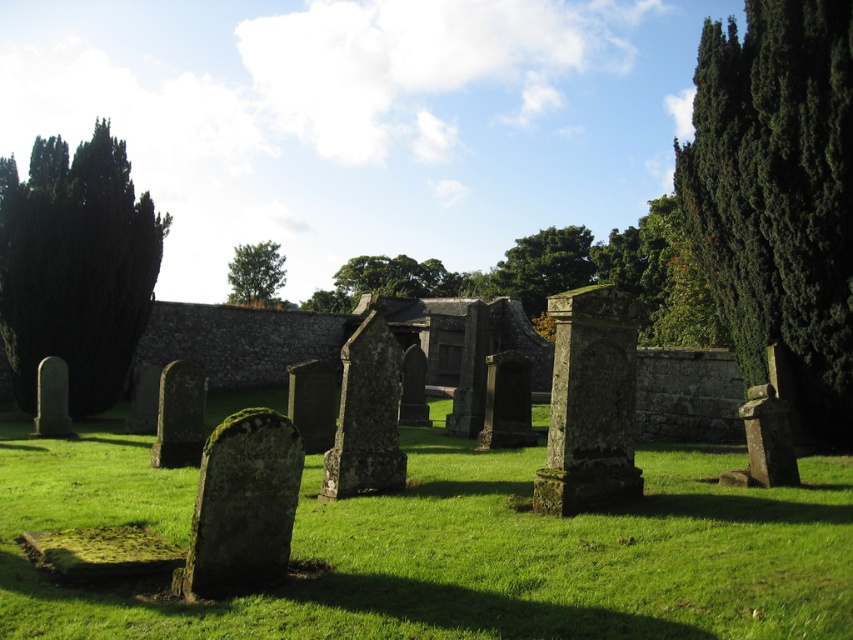
Which is more to the left, dark green coniferous tree at right or dark green coniferous tree at left?

Positioned to the left is dark green coniferous tree at left.

Is dark green coniferous tree at right smaller than dark green coniferous tree at left?

Yes, dark green coniferous tree at right is smaller than dark green coniferous tree at left.

Which is behind, point (842, 136) or point (28, 256)?

The point (28, 256) is more distant.

The width and height of the screenshot is (853, 640). In order to click on dark green coniferous tree at right in this screenshot , I will do `click(778, 195)`.

Between green mossy grass at center and dark green coniferous tree at right, which one appears on the right side from the viewer's perspective?

From the viewer's perspective, dark green coniferous tree at right appears more on the right side.

Between green mossy grass at center and dark green coniferous tree at right, which one appears on the left side from the viewer's perspective?

green mossy grass at center is more to the left.

Where is `green mossy grass at center`? The image size is (853, 640). green mossy grass at center is located at coordinates (451, 547).

Is point (291, 529) positioned behind point (274, 262)?

No, (291, 529) is in front of (274, 262).

Can you confirm if green mossy stone at center is smaller than green leafy tree at upper center?

Indeed, green mossy stone at center has a smaller size compared to green leafy tree at upper center.

The image size is (853, 640). Find the location of `green mossy stone at center`. green mossy stone at center is located at coordinates (242, 502).